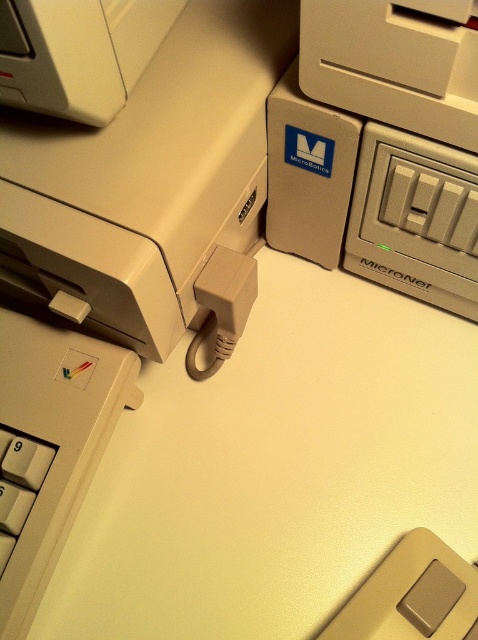
You are a technician trying to locate the white plastic keyboard at lower left in the image. What are the coordinates of its position?

The white plastic keyboard at lower left is located at coordinates point (50, 445).

Based on the photo, you are setting up a vintage computer workstation and need to connect the white plastic keyboard at lower left to the matte plastic power outlet at upper right. Given that the keyboard requires a 16 inch cable to reach the outlet, will the cable be long enough?

The white plastic keyboard at lower left is 16.50 inches away from the matte plastic power outlet at upper right. Since the required cable length is 16 inches, the cable will be too short by 0.50 inches to reach the outlet.